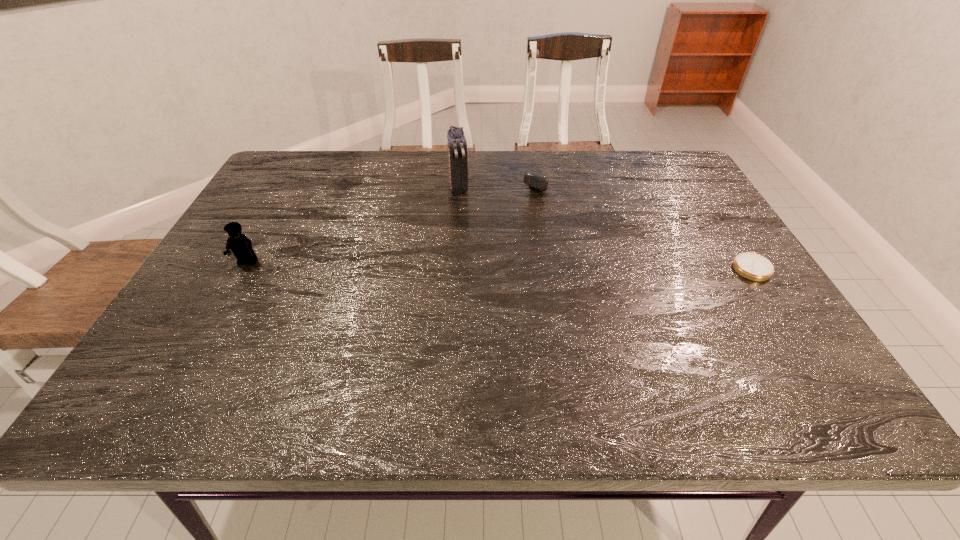
Image resolution: width=960 pixels, height=540 pixels. What are the coordinates of `the second tallest object` in the screenshot? It's located at point(240,245).

The width and height of the screenshot is (960, 540). I want to click on the leftmost object, so click(x=240, y=245).

This screenshot has width=960, height=540. Identify the location of the shortest object. (752, 266).

I want to click on compass, so click(752, 266).

Find the location of a particular element. The height and width of the screenshot is (540, 960). the second object from right to left is located at coordinates (534, 181).

Find the location of `the second shortest object`. the second shortest object is located at coordinates (534, 181).

The width and height of the screenshot is (960, 540). I want to click on the tallest object, so click(458, 172).

Where is `the third object from right to left`? The width and height of the screenshot is (960, 540). the third object from right to left is located at coordinates (458, 172).

I want to click on vacant area situated on the front-facing side of the Lego, so click(190, 364).

You are a GUI agent. You are given a task and a screenshot of the screen. Output one action in this format:
    pyautogui.click(x=<x>, y=<y>)
    Task: Click on the vacant space located 0.240m on the left of the compass
    The height and width of the screenshot is (540, 960).
    Given the screenshot: What is the action you would take?
    pyautogui.click(x=631, y=267)